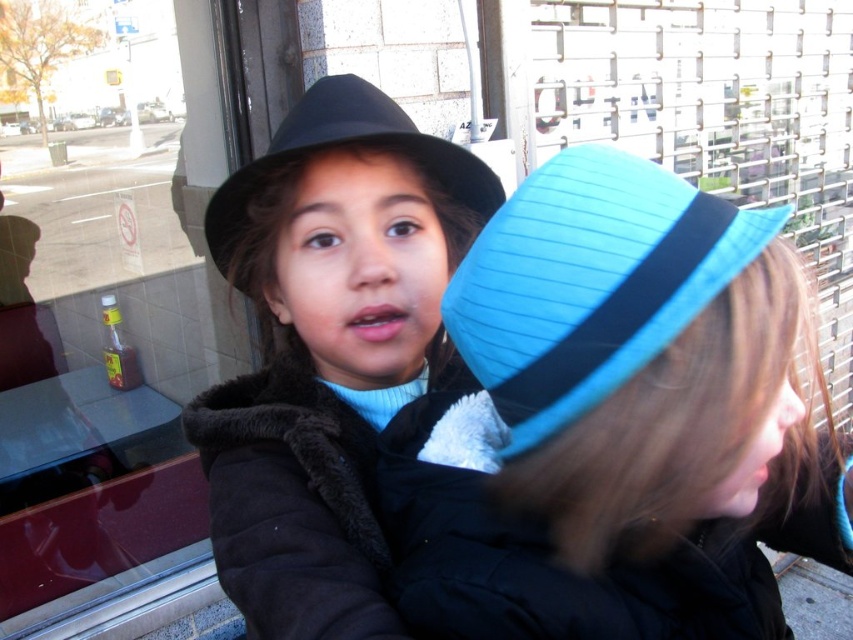
From the picture: You are a photographer trying to capture a clear shot of both the blue felt hat at upper center and the matte black hat at center. Based on their positions, which hat will appear larger in your photo?

The blue felt hat at upper center appears larger because it is closer to the viewer than the matte black hat at center.

You are a photographer trying to capture both the matte black hat at center and the blue fabric hat at upper right in a single frame. Given their sizes, which hat will appear larger in the photo?

The matte black hat at center will appear larger in the photo because it is bigger than the blue fabric hat at upper right.